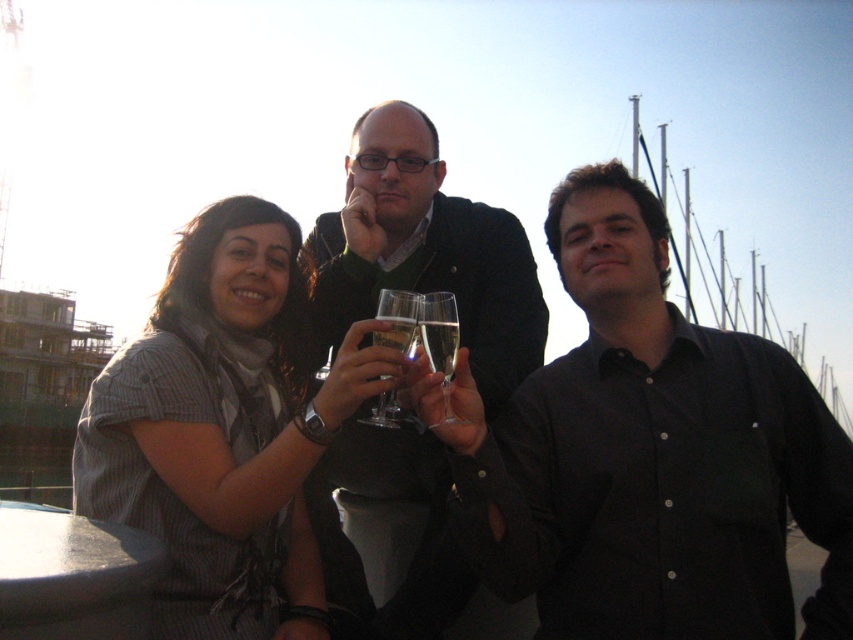
Question: Among these objects, which one is farthest from the camera?

Choices:
 (A) clear glass at center
 (B) clear glass wine glass at center

Answer: (A)

Question: Can you confirm if black shirt at center is positioned to the right of clear glass at center?

Choices:
 (A) yes
 (B) no

Answer: (A)

Question: Based on their relative distances, which object is nearer to the matte black sweater at center?

Choices:
 (A) striped fabric shirt at center
 (B) black shirt at center
 (C) clear glass wine glass at center

Answer: (A)

Question: Which of these objects is positioned closest to the clear glass champagne flute at center?

Choices:
 (A) clear glass wine glass at center
 (B) matte black sweater at center
 (C) striped fabric shirt at center
 (D) black shirt at center

Answer: (A)

Question: Does matte black sweater at center come in front of clear glass wine glass at center?

Choices:
 (A) no
 (B) yes

Answer: (A)

Question: Is black shirt at center bigger than striped fabric shirt at center?

Choices:
 (A) yes
 (B) no

Answer: (A)